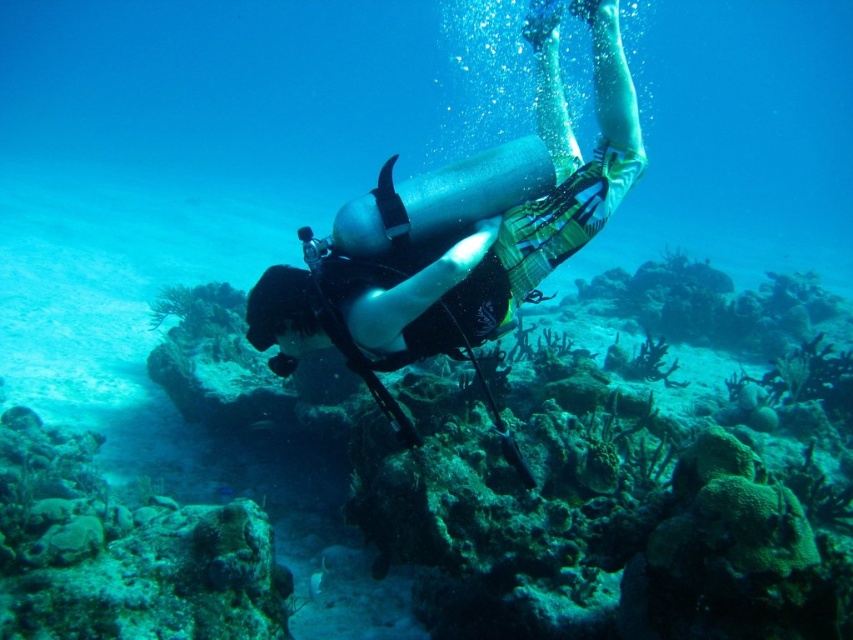
Does green coral reef at center come in front of silver metallic scuba diver at center?

No, green coral reef at center is further to the viewer.

Is green coral reef at center smaller than silver metallic scuba diver at center?

Actually, green coral reef at center might be larger than silver metallic scuba diver at center.

What do you see at coordinates (387, 500) in the screenshot? I see `green coral reef at center` at bounding box center [387, 500].

At what (x,y) coordinates should I click in order to perform the action: click on green coral reef at center. Please return your answer as a coordinate pair (x, y). Image resolution: width=853 pixels, height=640 pixels. Looking at the image, I should click on (387, 500).